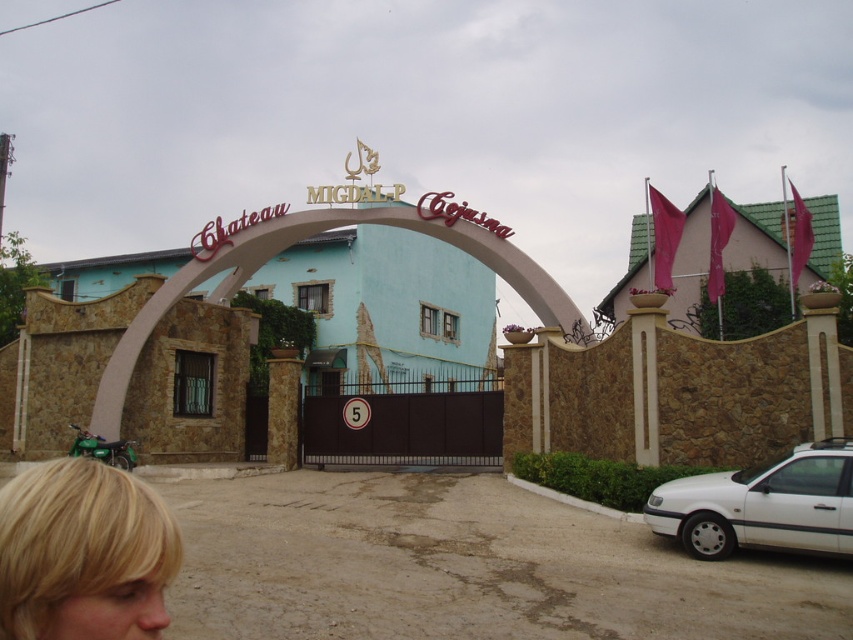
You are standing at the entrance of Chateau Migdal P Cojana and need to park your white matte car at lower right. According to the scene, where should you position your car to ensure it aligns with the property entrance?

The white matte car at lower right should be positioned at the coordinates (762,504) to align with the property entrance.

You are a delivery driver approaching the entrance of Chateu Migdal P Cojana. You see the stone archway at center and the white matte car at lower right. Can you determine which object is bigger in size?

The stone archway at center is larger in size than the white matte car at lower right, so the stone archway at center is bigger.

You are driving a white matte car at lower right towards the entrance of Chateu Migdal P Cojana. Can you pass under the stone archway at center without hitting it?

The stone archway at center is above the white matte car at lower right, so yes, the car can pass under the stone archway at center without hitting it as there is vertical clearance provided by the archway being positioned above the car.